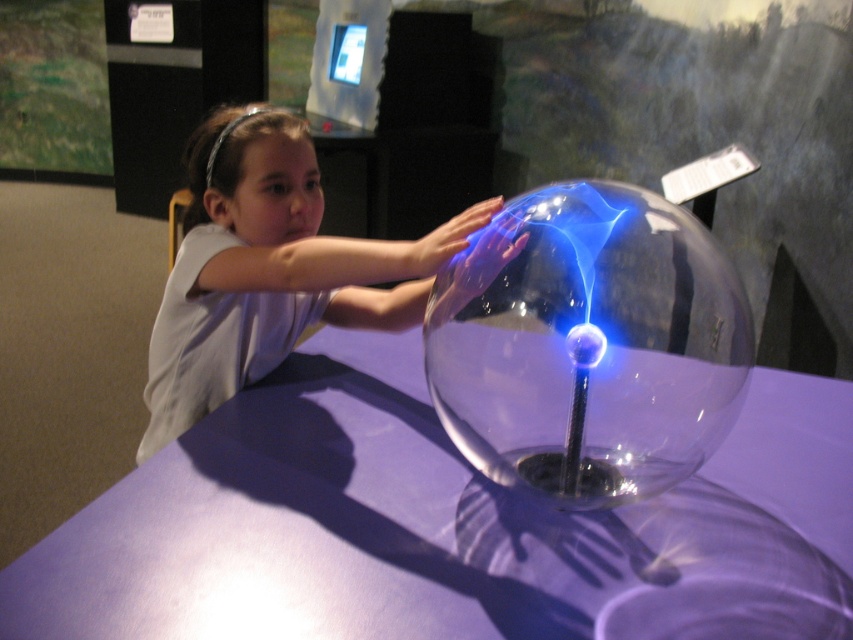
You are a museum visitor who wants to place a small souvenir on the purple glass table at center. The souvenir is 10 cm in diameter. Can you determine if the transparent glass sphere at center will interfere with placing it there?

The transparent glass sphere at center is resting on the purple glass table at center. Since the purple glass table at center might be wider than transparent glass sphere at center, there might be enough space around the sphere to place the souvenir without interference.

You are a museum visitor who wants to take a photo of the transparent glass sphere at center and the white glossy shirt at upper center. Which object should you focus on first if you want to capture both in the same frame without moving your camera?

The transparent glass sphere at center is positioned on the right side of white glossy shirt at upper center. To capture both in the same frame without moving the camera, focus on the white glossy shirt at upper center first since it is closer to the camera, allowing the sphere to remain in the background within the depth of field.